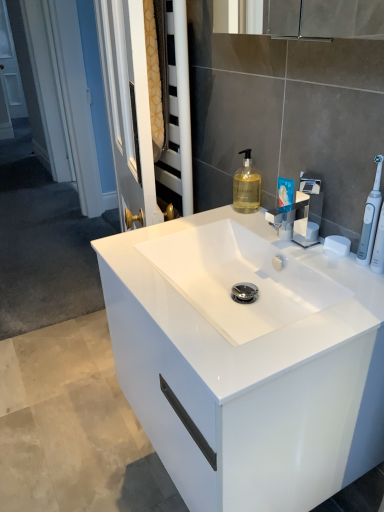
Locate an element on the screen. The height and width of the screenshot is (512, 384). vacant area that lies between white plastic toothbrush at right and satin nickel faucet at center is located at coordinates (321, 261).